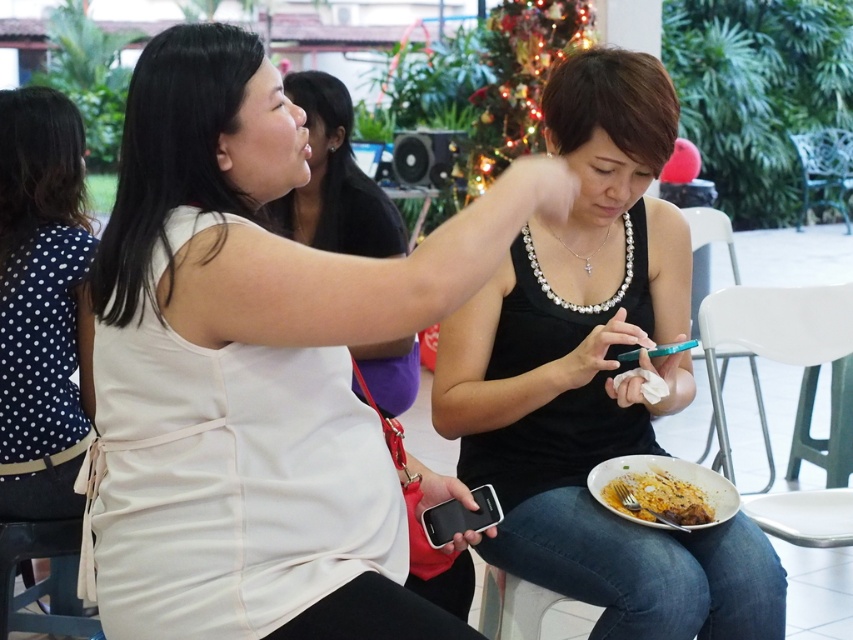
You are a photographer trying to capture a closeup of the golden crispy chicken at lower right without including the white matte dress at upper left in the frame. Is it possible based on their positions?

The white matte dress at upper left is further to the viewer than golden crispy chicken at lower right, so the golden crispy chicken at lower right is behind the white matte dress at upper left. Therefore, it might be challenging to capture the golden crispy chicken at lower right without including the white matte dress at upper left in the frame unless you adjust your angle or move closer.

You are a photographer holding a camera. You want to take a photo of the golden crispy chicken at lower right without moving the camera. Is the chicken within the camera lens range? The camera can capture objects within 2 meters.

The golden crispy chicken at lower right and camera are 1.97 meters apart from each other. Since the distance is less than 2 meters, the chicken is within the camera lens range.